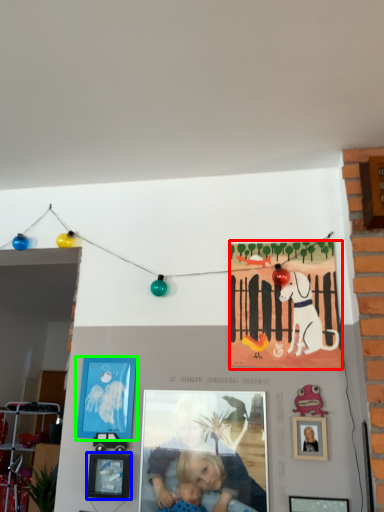
Question: Considering the real-world distances, which object is closest to poster (highlighted by a red box)? picture frame (highlighted by a blue box) or picture frame (highlighted by a green box).

Choices:
 (A) picture frame
 (B) picture frame

Answer: (B)